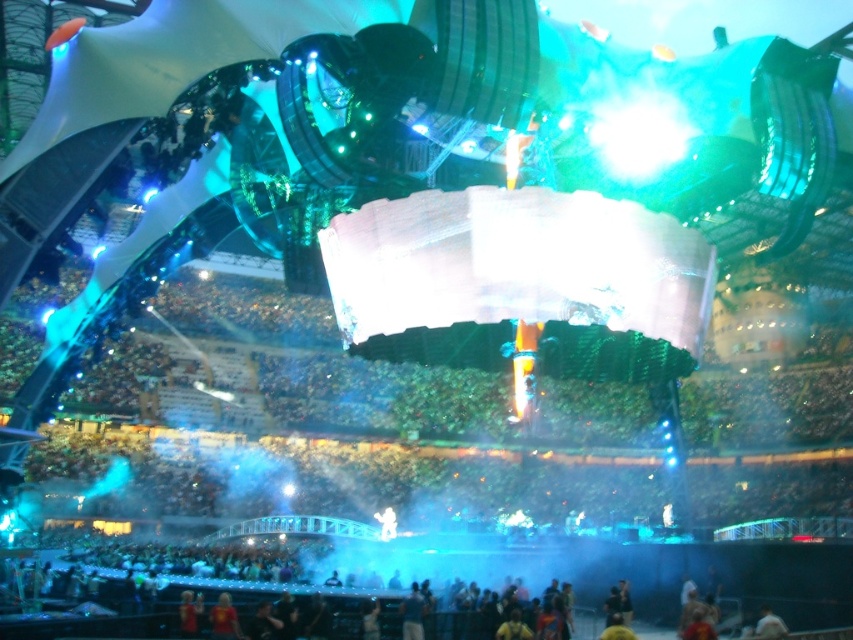
Question: Among these objects, which one is farthest from the camera?

Choices:
 (A) white matte shirt at center
 (B) dark blue fabric at lower center

Answer: (B)

Question: Estimate the real-world distances between objects in this image. Which object is farther from the white matte shirt at center?

Choices:
 (A) red shirt at lower center
 (B) dark blue fabric at lower center
 (C) yellow fabric person at lower center

Answer: (A)

Question: Is red shirt at lower center above dark blue fabric at lower center?

Choices:
 (A) no
 (B) yes

Answer: (B)

Question: Can you confirm if red shirt at lower center is wider than white matte shirt at center?

Choices:
 (A) no
 (B) yes

Answer: (A)

Question: Which object is the closest to the red shirt at lower center?

Choices:
 (A) white matte shirt at center
 (B) dark blue fabric at lower center

Answer: (B)

Question: Can you confirm if white matte shirt at center is positioned below yellow fabric person at lower center?

Choices:
 (A) yes
 (B) no

Answer: (B)